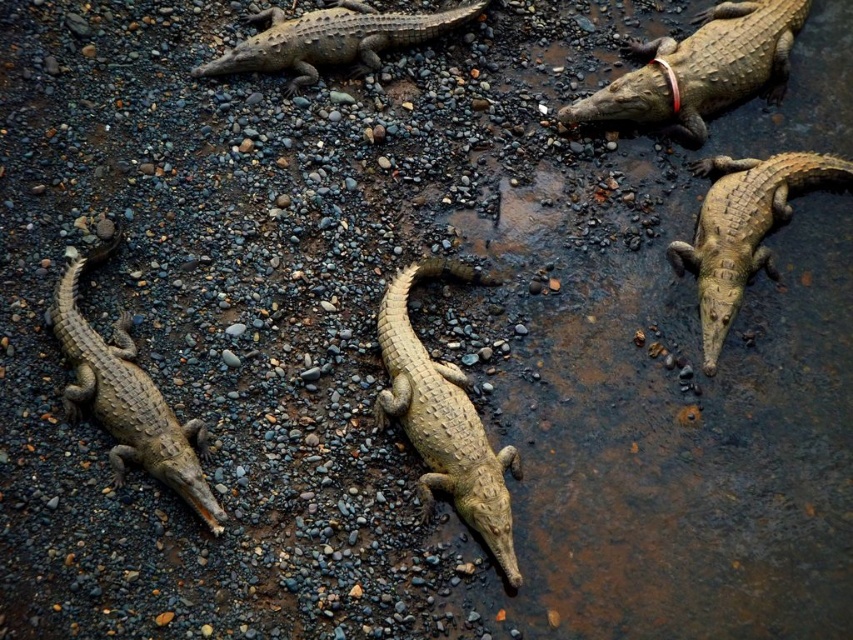
Question: Is smooth tan crocodile at center to the left of smooth brown crocodile at center from the viewer's perspective?

Choices:
 (A) yes
 (B) no

Answer: (A)

Question: Based on their relative distances, which object is nearer to the light brown textured skin at upper center?

Choices:
 (A) leathery brown crocodile at lower left
 (B) light brown textured skin at upper right
 (C) smooth brown crocodile at center
 (D) smooth tan crocodile at center

Answer: (B)

Question: Considering the relative positions of light brown textured skin at upper right and smooth brown crocodile at center in the image provided, where is light brown textured skin at upper right located with respect to smooth brown crocodile at center?

Choices:
 (A) left
 (B) right

Answer: (A)

Question: Which object is the farthest from the leathery brown crocodile at lower left?

Choices:
 (A) light brown textured skin at upper center
 (B) smooth tan crocodile at center
 (C) light brown textured skin at upper right

Answer: (C)

Question: Which object is closer to the camera taking this photo?

Choices:
 (A) light brown textured skin at upper center
 (B) smooth brown crocodile at center
 (C) light brown textured skin at upper right
 (D) leathery brown crocodile at lower left

Answer: (D)

Question: Is smooth tan crocodile at center below light brown textured skin at upper right?

Choices:
 (A) yes
 (B) no

Answer: (A)